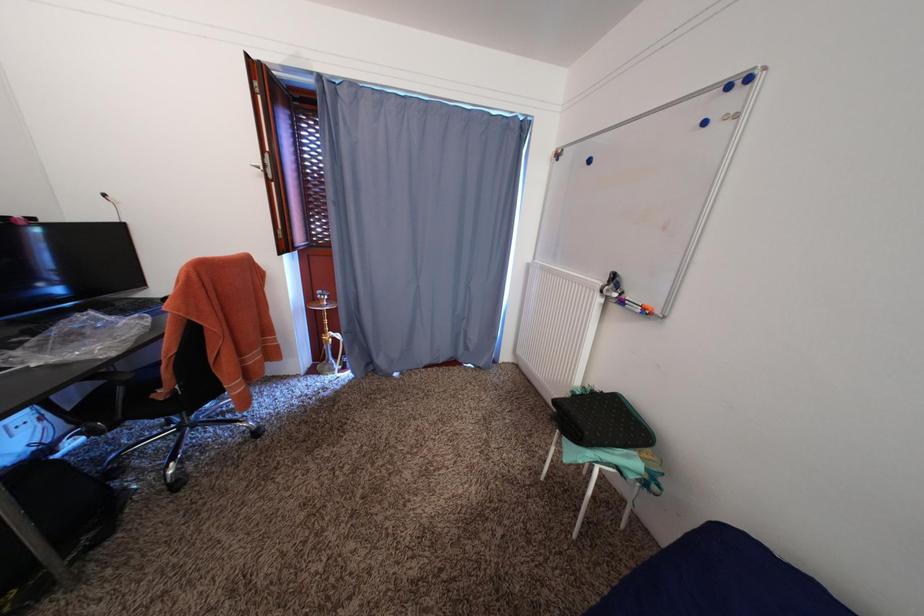
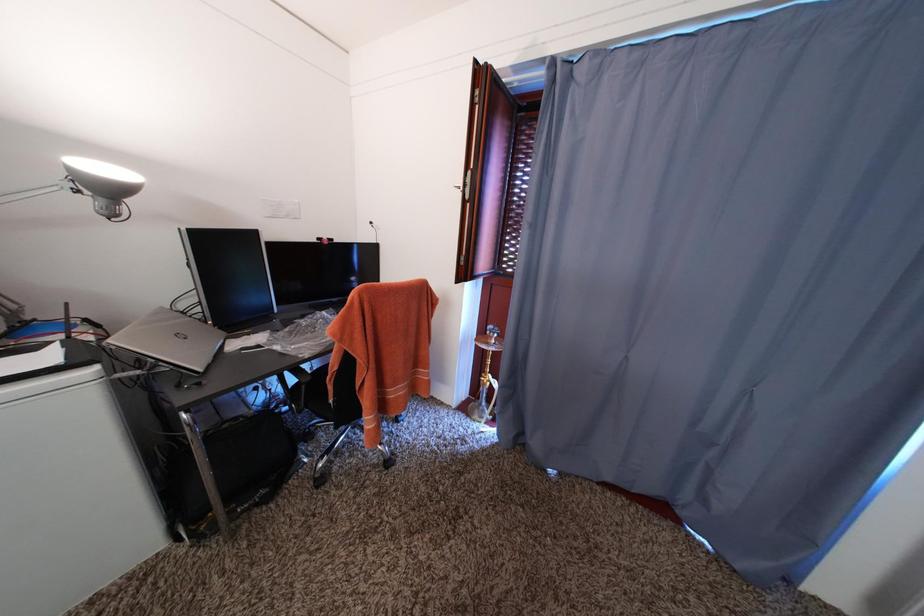
Question: The images are taken continuously from a first-person perspective. In which direction is your viewpoint rotating?

Choices:
 (A) Left
 (B) Right
 (C) Up
 (D) Down

Answer: (A)